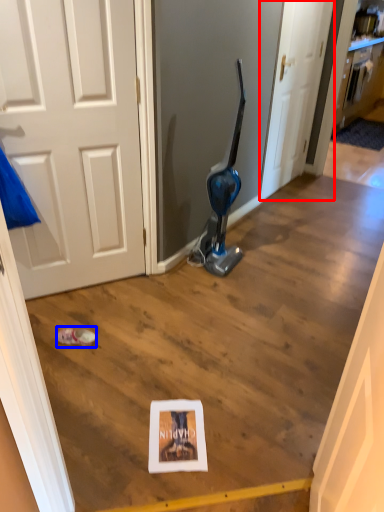
Question: Among these objects, which one is nearest to the camera, door (highlighted by a red box) or footwear (highlighted by a blue box)?

Choices:
 (A) door
 (B) footwear

Answer: (B)